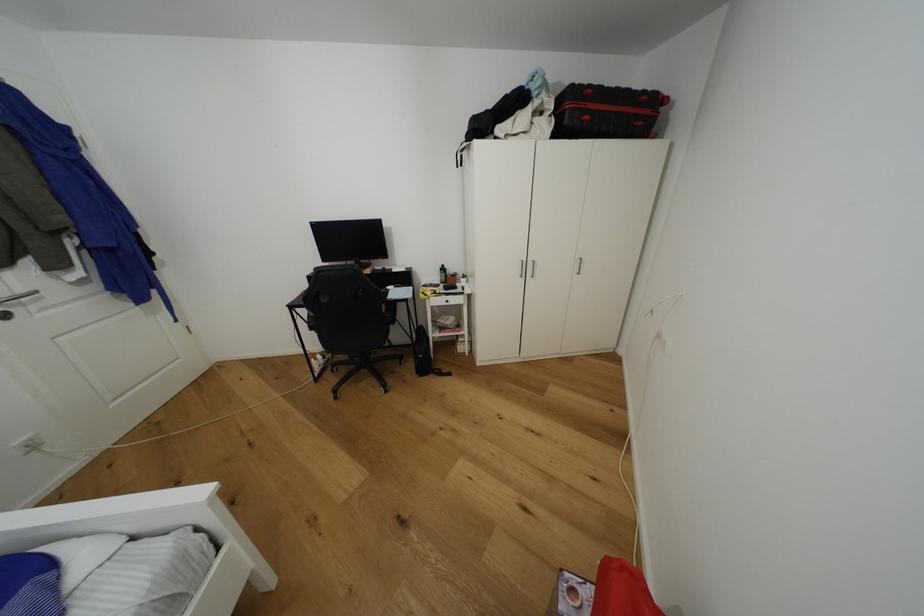
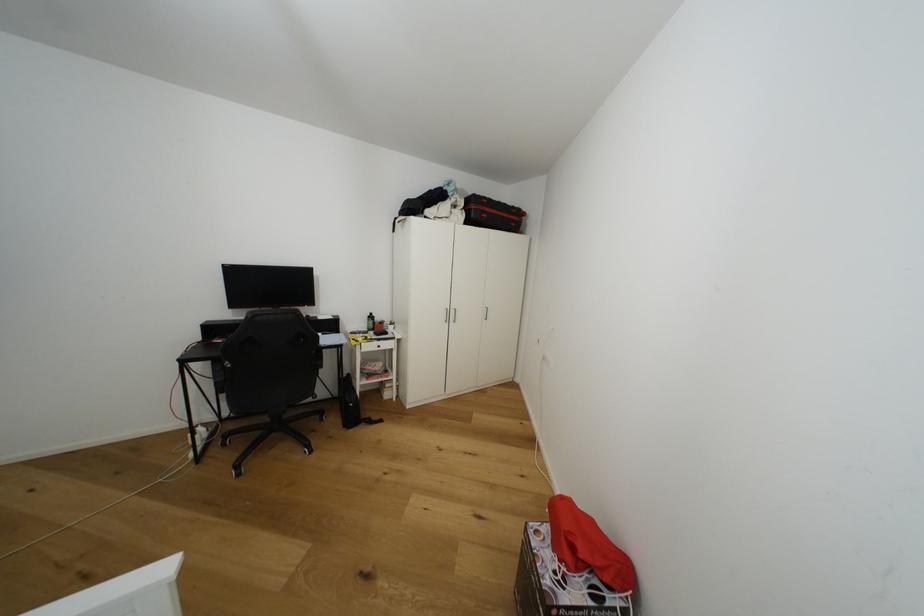
Looking at this image, what movement of the cameraman would produce the second image?

The movement direction of the cameraman is left, backward.